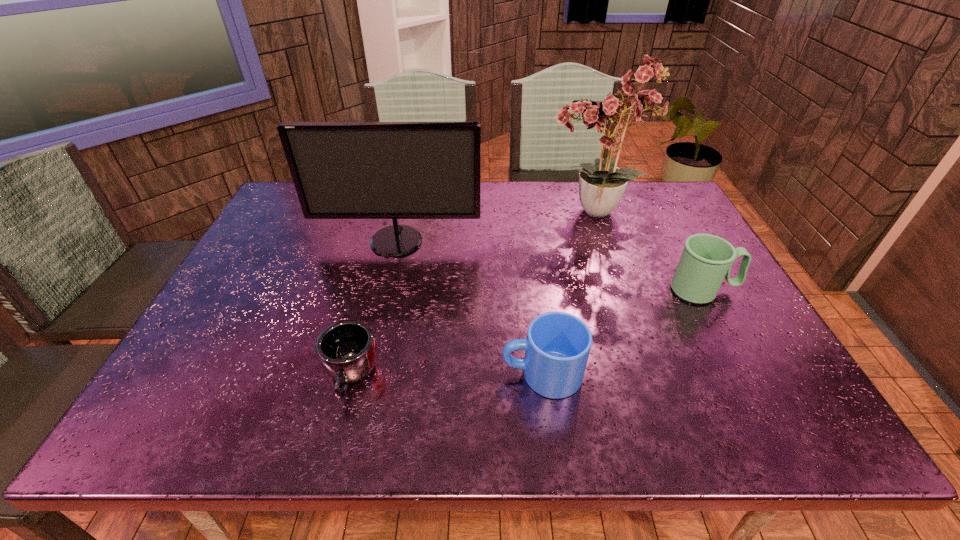
In the image, there is a desktop. At what (x,y) coordinates should I click in order to perform the action: click on vacant space at the left edge. Please return your answer as a coordinate pair (x, y). This screenshot has width=960, height=540. Looking at the image, I should click on (181, 369).

At what (x,y) coordinates should I click in order to perform the action: click on free spot at the right edge of the desktop. Please return your answer as a coordinate pair (x, y). This screenshot has width=960, height=540. Looking at the image, I should click on (741, 346).

The image size is (960, 540). In the image, there is a desktop. Identify the location of vacant area at the near left corner. (173, 418).

The width and height of the screenshot is (960, 540). In order to click on vacant space at the far right corner in this screenshot , I will do pos(671,220).

At what (x,y) coordinates should I click in order to perform the action: click on free space at the near right corner of the desktop. Please return your answer as a coordinate pair (x, y). The image size is (960, 540). Looking at the image, I should click on (821, 434).

The image size is (960, 540). Identify the location of vacant area that lies between the second mug from right to left and the computer monitor. (469, 308).

Locate an element on the screen. Image resolution: width=960 pixels, height=540 pixels. unoccupied area between the second tallest object and the flower arrangement is located at coordinates (495, 227).

Locate an element on the screen. vacant area that lies between the tallest object and the second tallest object is located at coordinates (495, 227).

This screenshot has height=540, width=960. Identify the location of free point between the shortest mug and the flower arrangement. (472, 295).

In order to click on empty location between the second mug from right to left and the computer monitor in this screenshot , I will do `click(469, 308)`.